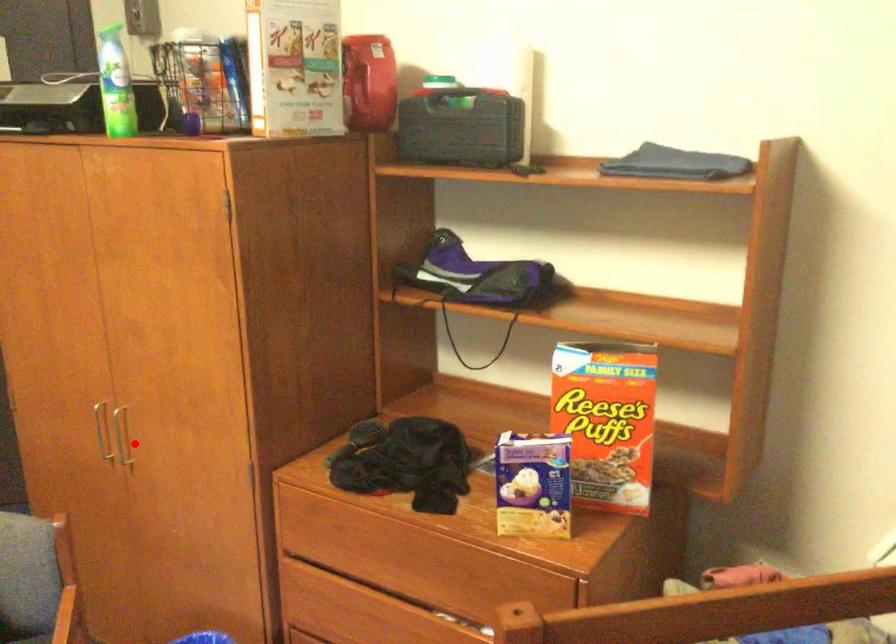
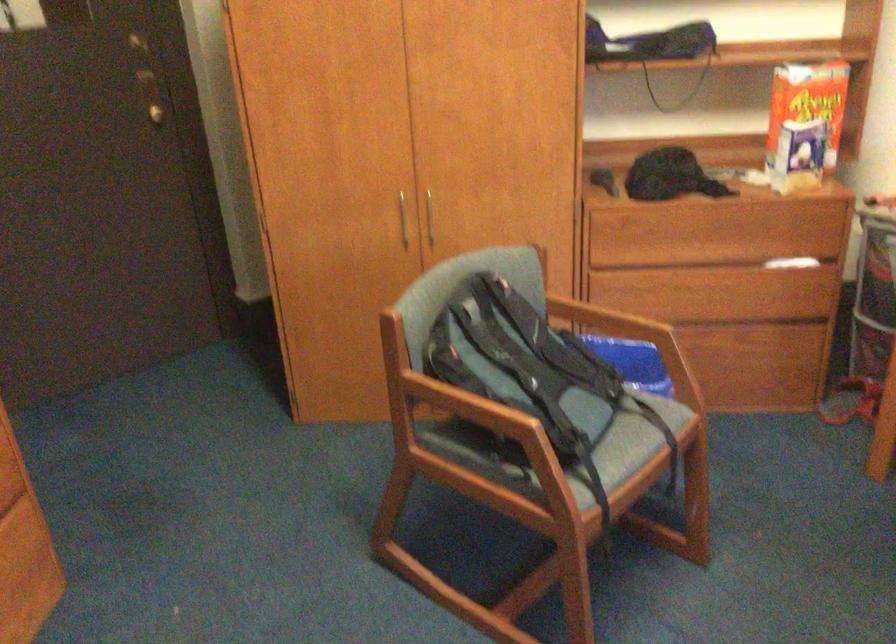
Question: A red point is marked in image1. In image2, is the corresponding 3D point closer to the camera or farther? Reply with the corresponding letter.

Choices:
 (A) The corresponding 3D point is closer.
 (B) The corresponding 3D point is farther.

Answer: (B)